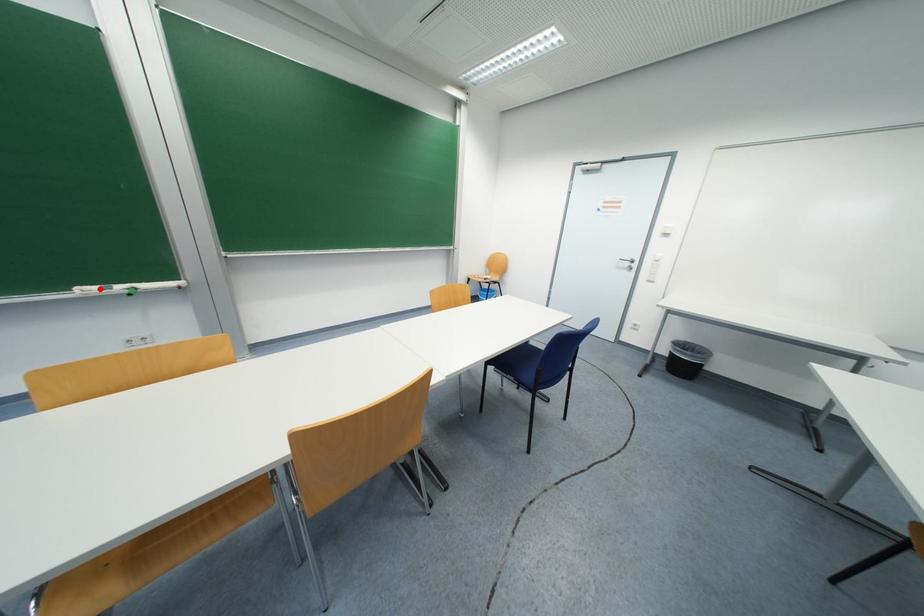
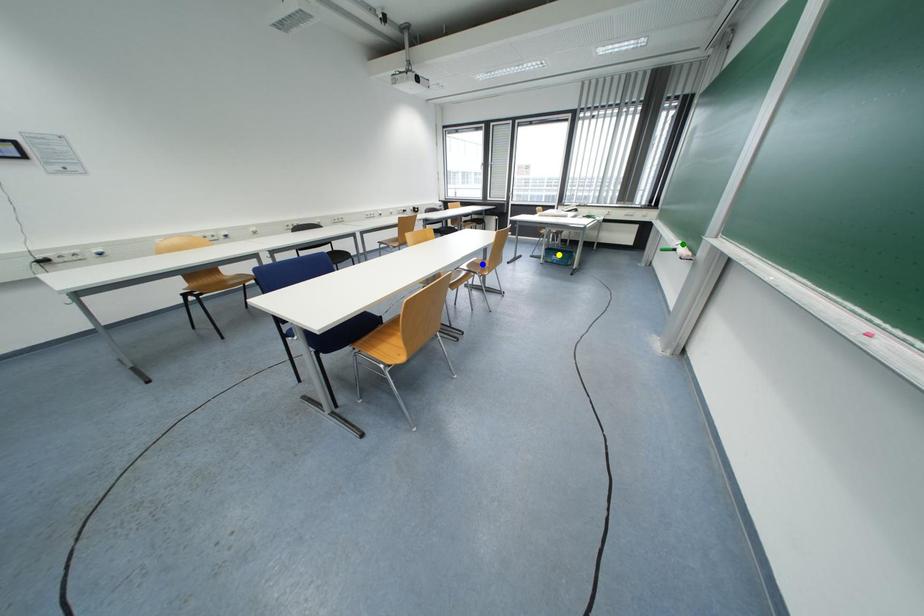
Question: I am providing you with two images of the same scene from different viewpoints. A red point is marked on the first image. You are given multiple points on the second image. Which point in image 2 represents the same 3d spot as the red point in image 1?

Choices:
 (A) blue point
 (B) yellow point
 (C) green point

Answer: (C)